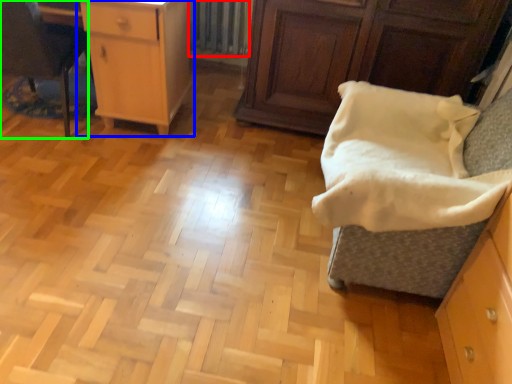
Question: Which object is the farthest from radiator (highlighted by a red box)? Choose among these: chest of drawers (highlighted by a blue box) or furniture (highlighted by a green box).

Choices:
 (A) chest of drawers
 (B) furniture

Answer: (B)